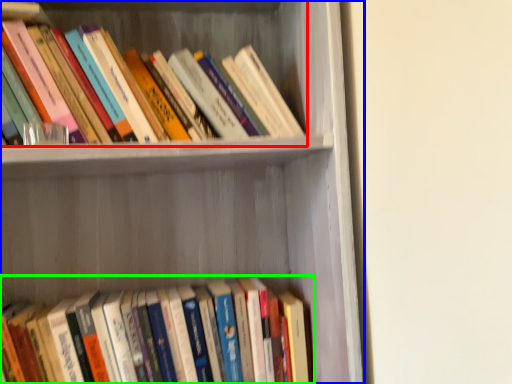
Question: Which object is positioned farthest from book (highlighted by a red box)? Select from shelf (highlighted by a blue box) and book (highlighted by a green box).

Choices:
 (A) shelf
 (B) book

Answer: (B)